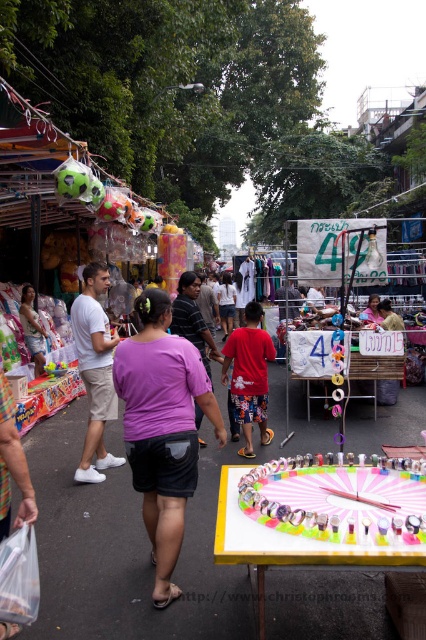
Which is more to the left, purple cotton shirt at center or white matte t-shirt at center?

From the viewer's perspective, white matte t-shirt at center appears more on the left side.

Which is below, purple cotton shirt at center or white matte t-shirt at center?

purple cotton shirt at center is below.

What do you see at coordinates (163, 428) in the screenshot? This screenshot has width=426, height=640. I see `purple cotton shirt at center` at bounding box center [163, 428].

This screenshot has width=426, height=640. What are the coordinates of `purple cotton shirt at center` in the screenshot? It's located at (163, 428).

Can you confirm if white matte t-shirt at center is positioned to the right of red cotton shirt at center?

Incorrect, white matte t-shirt at center is not on the right side of red cotton shirt at center.

Can you confirm if white matte t-shirt at center is bigger than red cotton shirt at center?

Yes.

Between point (97, 444) and point (239, 328), which one is positioned behind?

Point (239, 328)

Find the location of a particular element. white matte t-shirt at center is located at coordinates (94, 371).

Which is below, purple cotton shirt at center or red cotton shirt at center?

purple cotton shirt at center

Describe the element at coordinates (163, 428) in the screenshot. I see `purple cotton shirt at center` at that location.

Find the location of a particular element. The image size is (426, 640). purple cotton shirt at center is located at coordinates (163, 428).

The image size is (426, 640). I want to click on purple cotton shirt at center, so click(x=163, y=428).